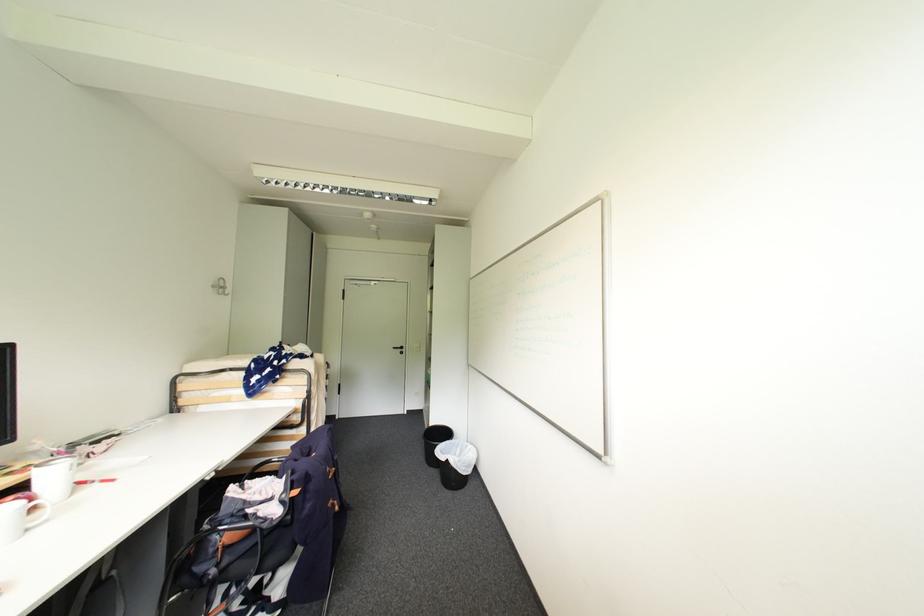
You are a GUI agent. You are given a task and a screenshot of the screen. Output one action in this format:
    pyautogui.click(x=<x>, y=<y>)
    Task: Click on the black door handle
    
    Given the screenshot: What is the action you would take?
    pyautogui.click(x=399, y=351)